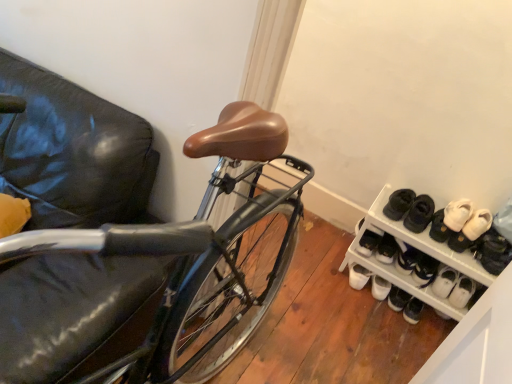
Locate an element on the screen. The image size is (512, 384). free space that is to the left of white plastic shoe rack at lower right is located at coordinates (326, 273).